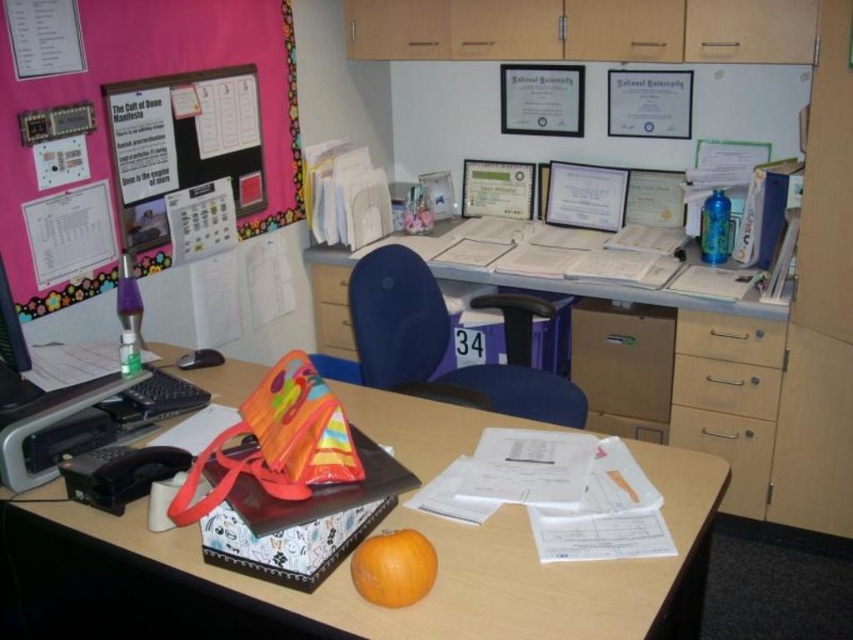
Does point (744, 305) come in front of point (228, 129)?

Yes, it is in front of point (228, 129).

Between matte plastic desk at center and black matte bulletin board at upper left, which one appears on the right side from the viewer's perspective?

matte plastic desk at center is more to the right.

Which is behind, point (445, 234) or point (181, 157)?

The point (445, 234) is more distant.

This screenshot has height=640, width=853. I want to click on matte plastic desk at center, so click(637, 365).

Who is positioned more to the left, black matte bulletin board at upper left or wooden drawer at right?

From the viewer's perspective, black matte bulletin board at upper left appears more on the left side.

Measure the distance between point (265, 195) and camera.

Point (265, 195) is 8.46 feet from camera.

Identify the location of black matte bulletin board at upper left. (183, 144).

Between wooden table at center and matte plastic desk at center, which one has more height?

With more height is matte plastic desk at center.

Locate an element on the screen. The image size is (853, 640). wooden table at center is located at coordinates (352, 586).